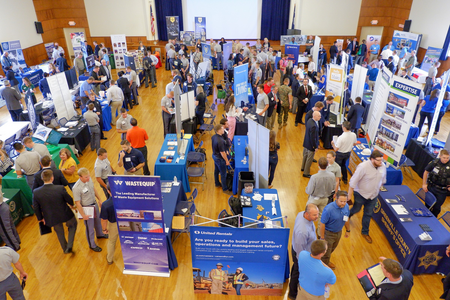
What are the coordinates of `tabletop poster` in the screenshot? It's located at (178, 124), (401, 107), (333, 75), (407, 39), (63, 96), (16, 57), (120, 52), (184, 101).